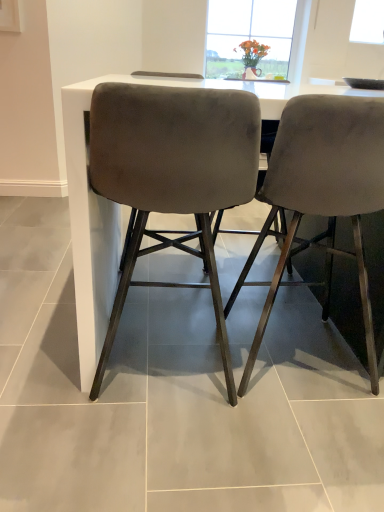
I want to click on suede-like gray chair at center, which is counted as the 2th chair, starting from the right, so click(172, 176).

What do you see at coordinates (172, 176) in the screenshot? I see `suede-like gray chair at center, which is counted as the 2th chair, starting from the right` at bounding box center [172, 176].

Find the location of a particular element. The height and width of the screenshot is (512, 384). velvet grey chair at right, which ranks as the second chair in left-to-right order is located at coordinates (322, 190).

Image resolution: width=384 pixels, height=512 pixels. What do you see at coordinates (322, 190) in the screenshot? I see `velvet grey chair at right, which ranks as the second chair in left-to-right order` at bounding box center [322, 190].

You are a GUI agent. You are given a task and a screenshot of the screen. Output one action in this format:
    pyautogui.click(x=<x>, y=<y>)
    Task: Click on the suede-like gray chair at center, which is counted as the 2th chair, starting from the right
    The image size is (384, 512).
    Given the screenshot: What is the action you would take?
    pyautogui.click(x=172, y=176)

Which is more to the left, suede-like gray chair at center, the first chair when ordered from left to right, or velvet grey chair at right, the first chair positioned from the right?

From the viewer's perspective, suede-like gray chair at center, the first chair when ordered from left to right, appears more on the left side.

Who is more distant, suede-like gray chair at center, the first chair when ordered from left to right, or velvet grey chair at right, the first chair positioned from the right?

velvet grey chair at right, the first chair positioned from the right.

Which is in front, point (189, 236) or point (362, 178)?

The point (362, 178) is in front.

From the image's perspective, which object appears higher, suede-like gray chair at center, the first chair when ordered from left to right, or velvet grey chair at right, the first chair positioned from the right?

velvet grey chair at right, the first chair positioned from the right.

From a real-world perspective, is suede-like gray chair at center, the first chair when ordered from left to right, physically above velvet grey chair at right, which ranks as the second chair in left-to-right order?

No, from a real-world perspective, suede-like gray chair at center, the first chair when ordered from left to right, is not on top of velvet grey chair at right, which ranks as the second chair in left-to-right order.

Between suede-like gray chair at center, which is counted as the 2th chair, starting from the right, and velvet grey chair at right, the first chair positioned from the right, which one has smaller width?

Thinner between the two is suede-like gray chair at center, which is counted as the 2th chair, starting from the right.

Which of these two, suede-like gray chair at center, which is counted as the 2th chair, starting from the right, or velvet grey chair at right, the first chair positioned from the right, stands shorter?

With less height is suede-like gray chair at center, which is counted as the 2th chair, starting from the right.

Which of these two, suede-like gray chair at center, which is counted as the 2th chair, starting from the right, or velvet grey chair at right, which ranks as the second chair in left-to-right order, is bigger?

velvet grey chair at right, which ranks as the second chair in left-to-right order.

Is suede-like gray chair at center, which is counted as the 2th chair, starting from the right, completely or partially outside of velvet grey chair at right, the first chair positioned from the right?

Indeed, suede-like gray chair at center, which is counted as the 2th chair, starting from the right, is completely outside velvet grey chair at right, the first chair positioned from the right.

Are suede-like gray chair at center, the first chair when ordered from left to right, and velvet grey chair at right, which ranks as the second chair in left-to-right order, beside each other?

suede-like gray chair at center, the first chair when ordered from left to right, and velvet grey chair at right, which ranks as the second chair in left-to-right order, are clearly separated.

Is suede-like gray chair at center, which is counted as the 2th chair, starting from the right, facing towards velvet grey chair at right, the first chair positioned from the right?

No, suede-like gray chair at center, which is counted as the 2th chair, starting from the right, is not aimed at velvet grey chair at right, the first chair positioned from the right.

In the image, there is a velvet grey chair at right, the first chair positioned from the right. Identify the location of chair below it (from a real-world perspective). Image resolution: width=384 pixels, height=512 pixels. click(172, 176).

Between velvet grey chair at right, which ranks as the second chair in left-to-right order, and suede-like gray chair at center, the first chair when ordered from left to right, which one appears on the left side from the viewer's perspective?

suede-like gray chair at center, the first chair when ordered from left to right.

Is velvet grey chair at right, the first chair positioned from the right, further to the viewer compared to suede-like gray chair at center, which is counted as the 2th chair, starting from the right?

That is True.

Is point (310, 148) farther from viewer compared to point (241, 131)?

Yes, it is behind point (241, 131).

From the image's perspective, who appears lower, velvet grey chair at right, which ranks as the second chair in left-to-right order, or suede-like gray chair at center, which is counted as the 2th chair, starting from the right?

suede-like gray chair at center, which is counted as the 2th chair, starting from the right, from the image's perspective.

From a real-world perspective, which is physically above, velvet grey chair at right, which ranks as the second chair in left-to-right order, or suede-like gray chair at center, the first chair when ordered from left to right?

velvet grey chair at right, which ranks as the second chair in left-to-right order.

Can you confirm if velvet grey chair at right, the first chair positioned from the right, is thinner than suede-like gray chair at center, which is counted as the 2th chair, starting from the right?

In fact, velvet grey chair at right, the first chair positioned from the right, might be wider than suede-like gray chair at center, which is counted as the 2th chair, starting from the right.

From their relative heights in the image, would you say velvet grey chair at right, the first chair positioned from the right, is taller or shorter than suede-like gray chair at center, the first chair when ordered from left to right?

Considering their sizes, velvet grey chair at right, the first chair positioned from the right, has more height than suede-like gray chair at center, the first chair when ordered from left to right.

Which of these two, velvet grey chair at right, which ranks as the second chair in left-to-right order, or suede-like gray chair at center, which is counted as the 2th chair, starting from the right, is smaller?

suede-like gray chair at center, which is counted as the 2th chair, starting from the right, is smaller.

Which is correct: velvet grey chair at right, which ranks as the second chair in left-to-right order, is inside suede-like gray chair at center, which is counted as the 2th chair, starting from the right, or outside of it?

velvet grey chair at right, which ranks as the second chair in left-to-right order, exists outside the volume of suede-like gray chair at center, which is counted as the 2th chair, starting from the right.

Based on the photo, is velvet grey chair at right, the first chair positioned from the right, placed right next to suede-like gray chair at center, the first chair when ordered from left to right?

No.

Is velvet grey chair at right, the first chair positioned from the right, oriented away from suede-like gray chair at center, the first chair when ordered from left to right?

velvet grey chair at right, the first chair positioned from the right, is not turned away from suede-like gray chair at center, the first chair when ordered from left to right.

How different are the orientations of velvet grey chair at right, the first chair positioned from the right, and suede-like gray chair at center, the first chair when ordered from left to right, in degrees?

The angular difference between velvet grey chair at right, the first chair positioned from the right, and suede-like gray chair at center, the first chair when ordered from left to right, is 4.54e-05 degrees.

At what (x,y) coordinates should I click in order to perform the action: click on chair above the suede-like gray chair at center, which is counted as the 2th chair, starting from the right (from a real-world perspective). Please return your answer as a coordinate pair (x, y). Looking at the image, I should click on (322, 190).

What are the coordinates of `chair on the left of the velvet grey chair at right, which ranks as the second chair in left-to-right order` in the screenshot? It's located at tap(172, 176).

Where is `chair that appears above the suede-like gray chair at center, the first chair when ordered from left to right (from the image's perspective)`? The width and height of the screenshot is (384, 512). chair that appears above the suede-like gray chair at center, the first chair when ordered from left to right (from the image's perspective) is located at coordinates coord(322,190).